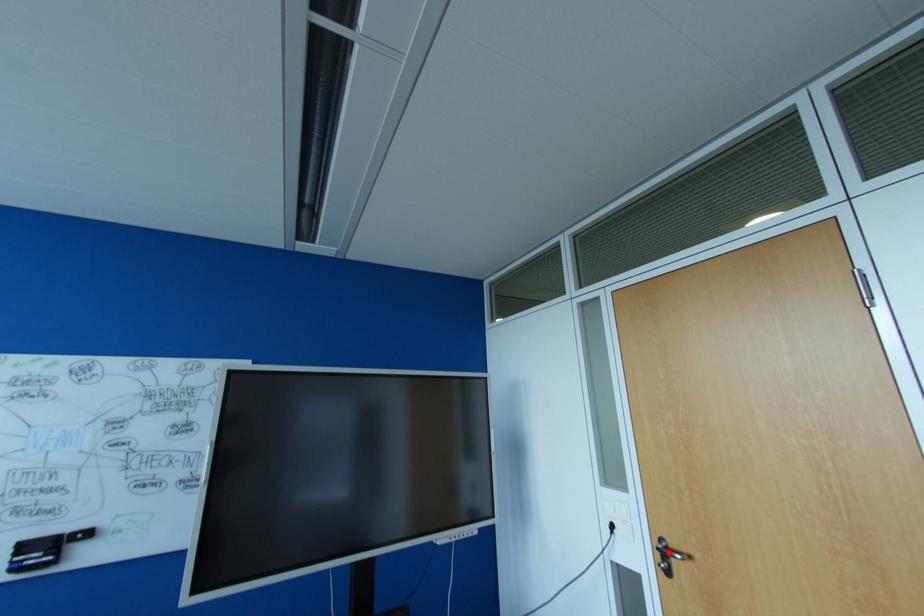
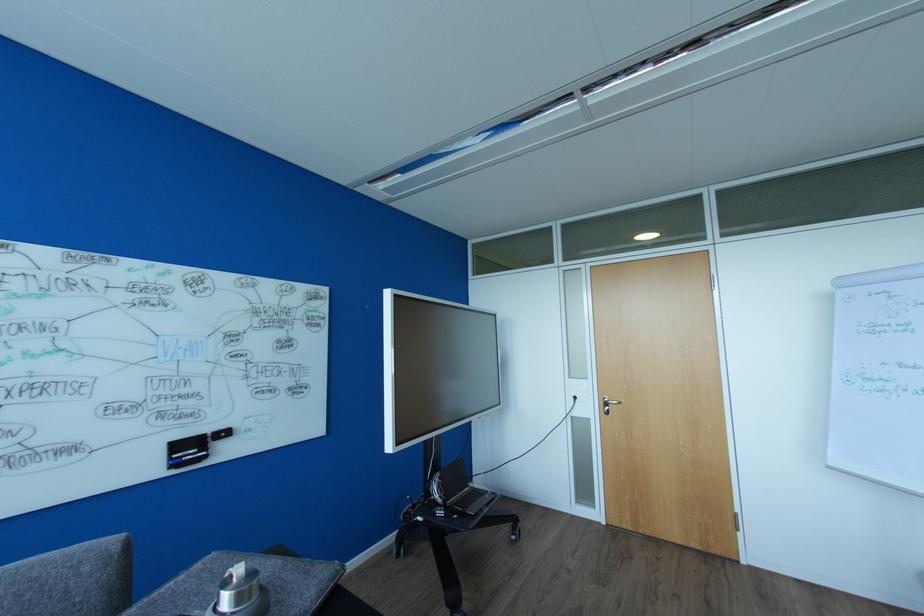
Question: I am providing you with two images of the same scene from different viewpoints. A red point is shown in image1. For the corresponding object point in image2, is it positioned nearer or farther from the camera?

Choices:
 (A) Nearer
 (B) Farther

Answer: (B)